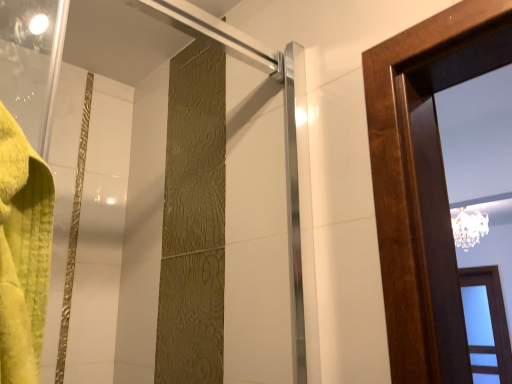
What do you see at coordinates (490, 321) in the screenshot?
I see `frosted glass window at right` at bounding box center [490, 321].

Locate an element on the screen. frosted glass window at right is located at coordinates (490, 321).

I want to click on frosted glass window at right, so click(x=490, y=321).